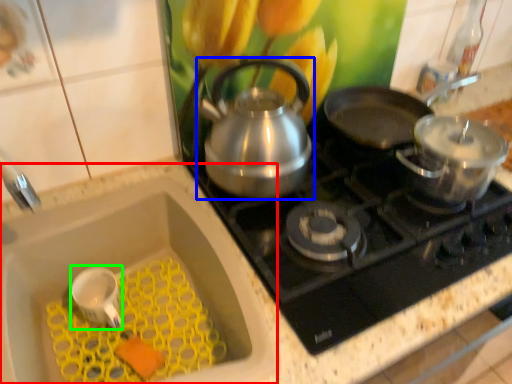
Question: Based on their relative distances, which object is nearer to sink (highlighted by a red box)? Choose from kettle (highlighted by a blue box) and appliance (highlighted by a green box).

Choices:
 (A) kettle
 (B) appliance

Answer: (B)